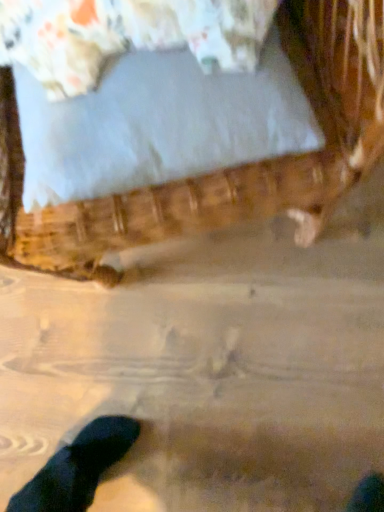
Question: Does point (218, 14) appear closer or farther from the camera than point (3, 199)?

Choices:
 (A) farther
 (B) closer

Answer: (B)

Question: Relative to wooden bed at upper center, is white fabric pillow at upper center in front or behind?

Choices:
 (A) front
 (B) behind

Answer: (B)

Question: Is white fabric pillow at upper center taller or shorter than wooden bed at upper center?

Choices:
 (A) short
 (B) tall

Answer: (A)

Question: Is wooden bed at upper center in front of or behind white fabric pillow at upper center in the image?

Choices:
 (A) behind
 (B) front

Answer: (B)

Question: In terms of height, does wooden bed at upper center look taller or shorter compared to white fabric pillow at upper center?

Choices:
 (A) short
 (B) tall

Answer: (B)

Question: From the image's perspective, is wooden bed at upper center positioned above or below white fabric pillow at upper center?

Choices:
 (A) below
 (B) above

Answer: (B)

Question: Does point (259, 177) appear closer or farther from the camera than point (185, 5)?

Choices:
 (A) closer
 (B) farther

Answer: (B)